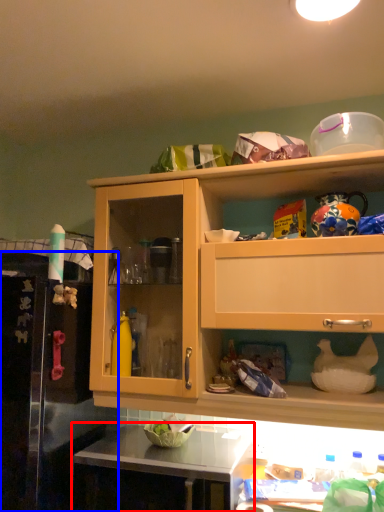
Question: Which object is further to the camera taking this photo, countertop (highlighted by a red box) or leftover (highlighted by a blue box)?

Choices:
 (A) countertop
 (B) leftover

Answer: (A)